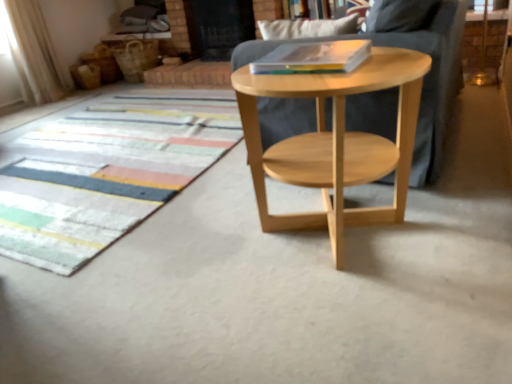
Question: Should I look upward or downward to see multicolored woven mat at lower left?

Choices:
 (A) up
 (B) down

Answer: (A)

Question: Does hardcover book at center turn towards multicolored woven mat at lower left?

Choices:
 (A) yes
 (B) no

Answer: (B)

Question: Is hardcover book at center in front of multicolored woven mat at lower left?

Choices:
 (A) no
 (B) yes

Answer: (B)

Question: Is hardcover book at center facing away from multicolored woven mat at lower left?

Choices:
 (A) yes
 (B) no

Answer: (B)

Question: From the image's perspective, is hardcover book at center over multicolored woven mat at lower left?

Choices:
 (A) yes
 (B) no

Answer: (A)

Question: Can you confirm if hardcover book at center is shorter than multicolored woven mat at lower left?

Choices:
 (A) no
 (B) yes

Answer: (A)

Question: Is the depth of hardcover book at center greater than that of multicolored woven mat at lower left?

Choices:
 (A) no
 (B) yes

Answer: (A)

Question: Is natural wood side table at center positioned behind transparent glass screen door at upper center?

Choices:
 (A) yes
 (B) no

Answer: (B)

Question: Does natural wood side table at center have a larger size compared to transparent glass screen door at upper center?

Choices:
 (A) yes
 (B) no

Answer: (A)

Question: Would you say natural wood side table at center is outside transparent glass screen door at upper center?

Choices:
 (A) yes
 (B) no

Answer: (A)

Question: Is natural wood side table at center turned away from transparent glass screen door at upper center?

Choices:
 (A) no
 (B) yes

Answer: (A)

Question: Is natural wood side table at center shorter than transparent glass screen door at upper center?

Choices:
 (A) yes
 (B) no

Answer: (B)

Question: Is natural wood side table at center at the right side of transparent glass screen door at upper center?

Choices:
 (A) yes
 (B) no

Answer: (A)

Question: Is transparent glass screen door at upper center placed right next to multicolored woven mat at lower left?

Choices:
 (A) yes
 (B) no

Answer: (B)